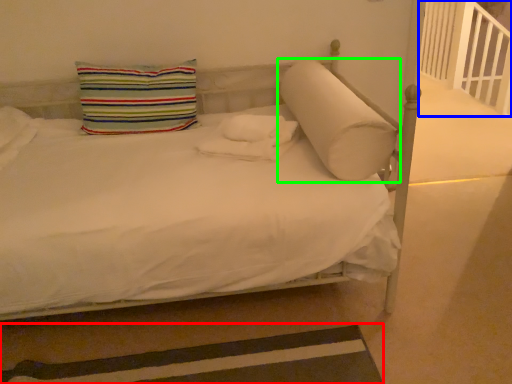
Question: Considering the real-world distances, which object is closest to strip (highlighted by a red box)? balustrade (highlighted by a blue box) or pillow (highlighted by a green box).

Choices:
 (A) balustrade
 (B) pillow

Answer: (B)